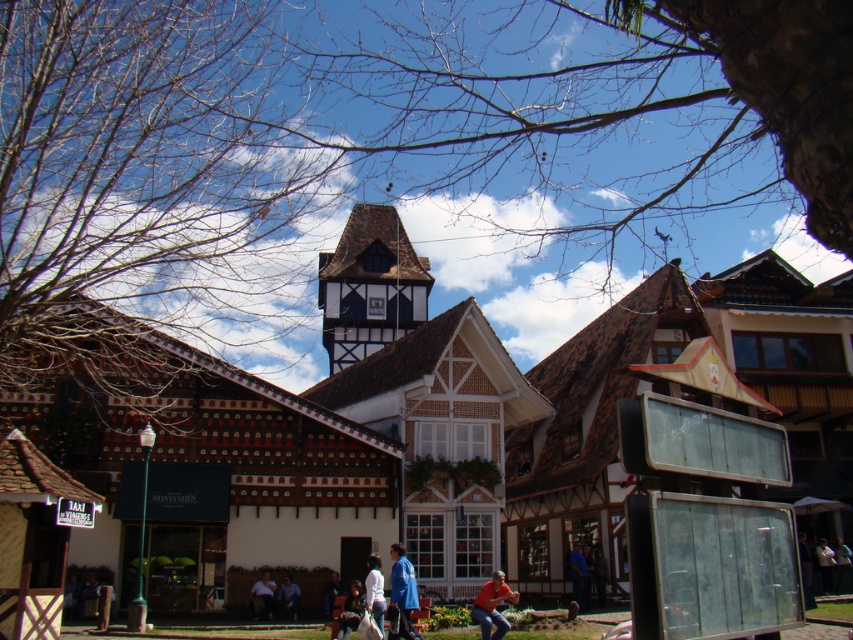
Does matte red shirt at lower center have a lesser width compared to blue fabric shirt at lower center?

No, matte red shirt at lower center is not thinner than blue fabric shirt at lower center.

The image size is (853, 640). Find the location of `matte red shirt at lower center`. matte red shirt at lower center is located at coordinates pos(492,605).

Which is behind, point (500, 577) or point (582, 582)?

The point (582, 582) is more distant.

At what (x,y) coordinates should I click in order to perform the action: click on matte red shirt at lower center. Please return your answer as a coordinate pair (x, y). This screenshot has height=640, width=853. Looking at the image, I should click on (492, 605).

Is point (102, 408) positioned behind point (355, 628)?

Yes, point (102, 408) is farther from viewer.

You are a GUI agent. You are given a task and a screenshot of the screen. Output one action in this format:
    pyautogui.click(x=<x>, y=<y>)
    Task: Click on the wooden building at center
    The height and width of the screenshot is (640, 853).
    Given the screenshot: What is the action you would take?
    pyautogui.click(x=341, y=433)

Is point (225, 497) farther from viewer compared to point (350, 586)?

Yes, point (225, 497) is farther from viewer.

Identify the location of wooden building at center. (341, 433).

Based on the photo, does light brown leather jacket at lower center appear on the left side of blue denim jeans at lower center?

Yes, light brown leather jacket at lower center is to the left of blue denim jeans at lower center.

Is point (252, 586) positioned after point (285, 604)?

Yes, point (252, 586) is farther from viewer.

The height and width of the screenshot is (640, 853). I want to click on light brown leather jacket at lower center, so click(262, 595).